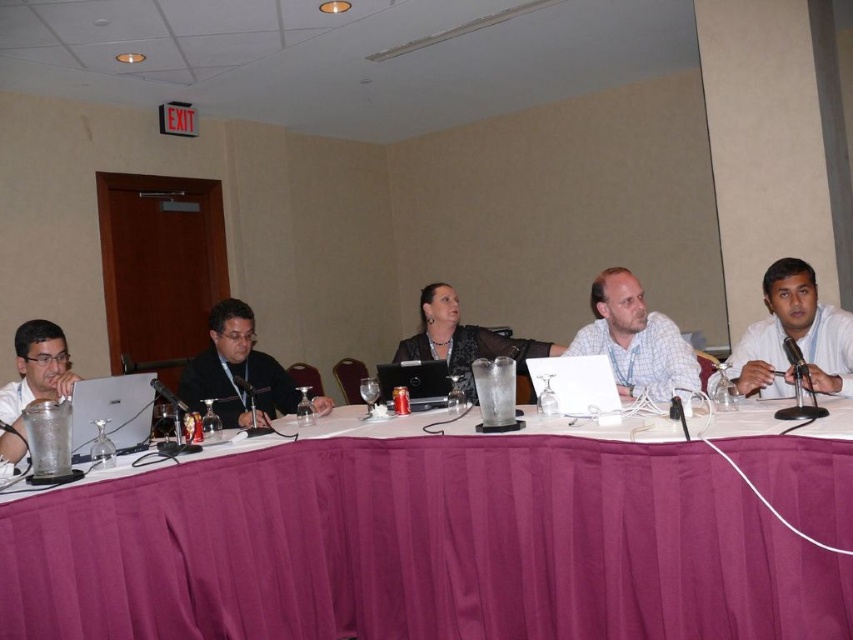
You are organizing a meeting and need to place a new item between the matte black suit at center and the silver metallic laptop at left. Considering their widths, which object should be placed closer to the narrower side?

The silver metallic laptop at left is narrower than the matte black suit at center. Therefore, the new item should be placed closer to the silver metallic laptop at left to accommodate the width difference.

You are a server at a conference and need to place a new water bottle between the white shirt at right and the clear plastic cup at left. Based on their positions, which side should you place it closer to?

The white shirt at right is taller than the clear plastic cup at left, so you should place the water bottle closer to the clear plastic cup at left to maintain balance in height between the two objects.

From the picture: You are sitting at the conference table and notice a white shirt at right and a clear plastic cup at left. Which object is positioned more to the right side of the table?

The white shirt at right is positioned more to the right side of the table than the clear plastic cup at left.